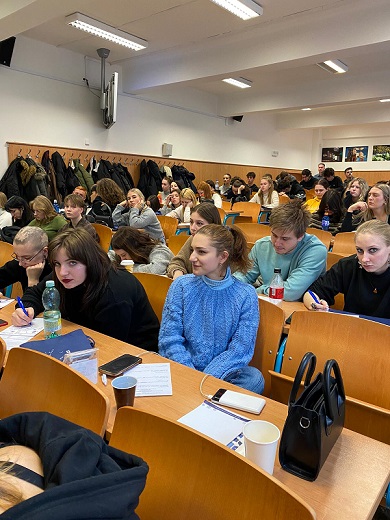
Find the location of a particular element. lights is located at coordinates (238, 9), (119, 41), (234, 84), (331, 65).